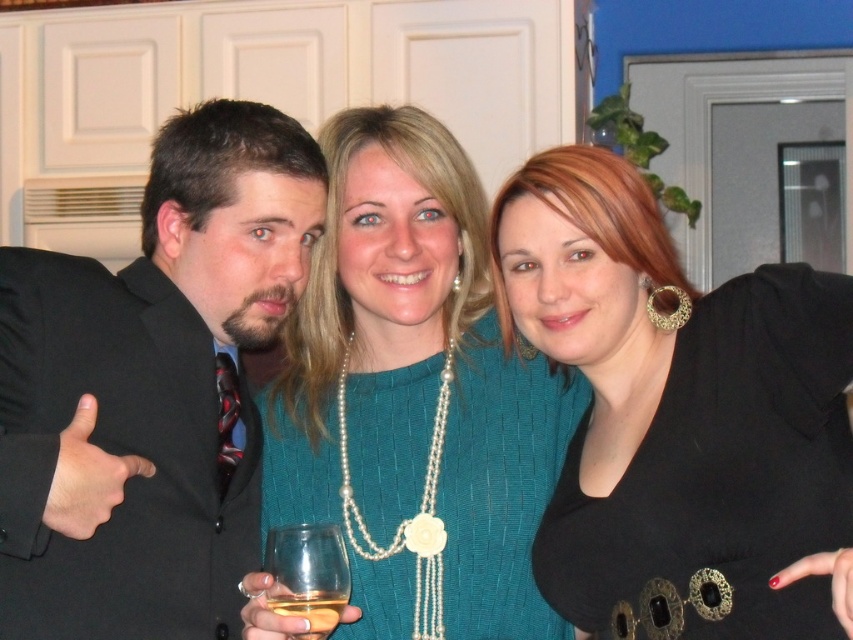
Question: Is black suit at left to the left of clear glass wine glass at center from the viewer's perspective?

Choices:
 (A) no
 (B) yes

Answer: (B)

Question: Which of these objects is positioned farthest from the clear glass wine glass at center?

Choices:
 (A) black leather dress at right
 (B) teal knitwear at center

Answer: (A)

Question: Which point is farther from the camera taking this photo?

Choices:
 (A) (840, 397)
 (B) (329, 614)

Answer: (A)

Question: Based on their relative distances, which object is farther from the black leather dress at right?

Choices:
 (A) clear glass wine glass at center
 (B) black suit at left

Answer: (B)

Question: Does teal knitwear at center appear over clear glass wine glass at center?

Choices:
 (A) no
 (B) yes

Answer: (B)

Question: Can you confirm if clear glass wine glass at center is wider than translucent glass at center?

Choices:
 (A) no
 (B) yes

Answer: (B)